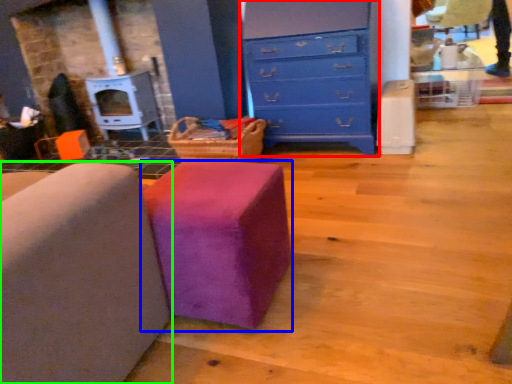
Question: Which object is positioned closest to chest of drawers (highlighted by a red box)? Select from furniture (highlighted by a blue box) and furniture (highlighted by a green box).

Choices:
 (A) furniture
 (B) furniture

Answer: (A)